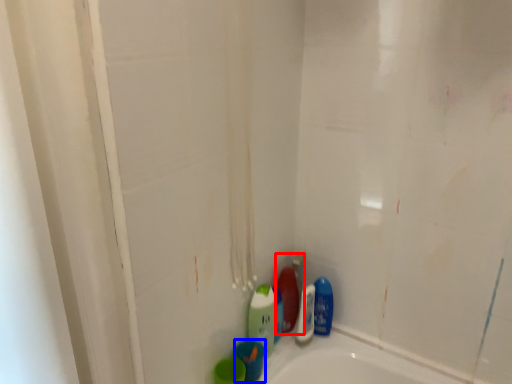
Question: Which object appears closest to the camera in this image, cleaning product (highlighted by a red box) or mouthwash (highlighted by a blue box)?

Choices:
 (A) cleaning product
 (B) mouthwash

Answer: (B)